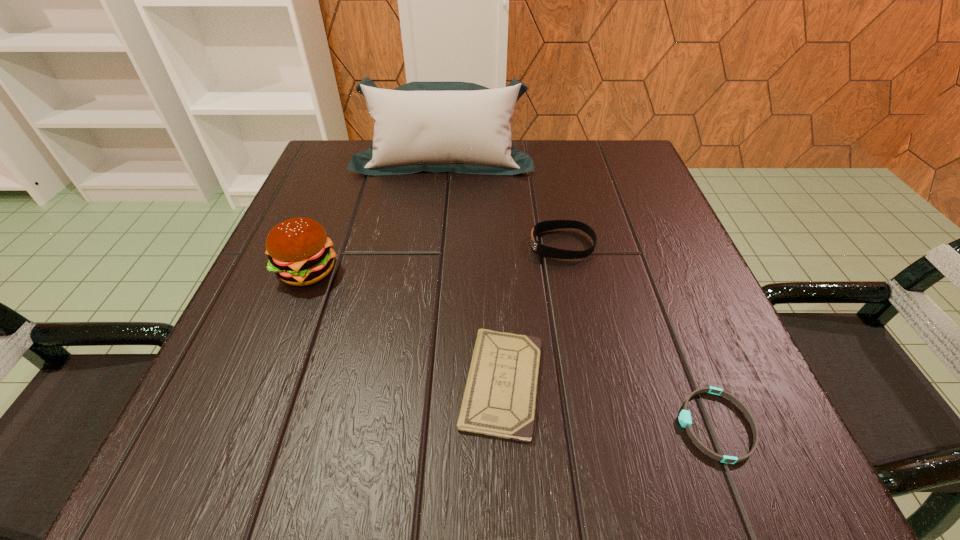
The height and width of the screenshot is (540, 960). Identify the location of vacant space that's between the second tallest object and the farthest object. (375, 214).

This screenshot has height=540, width=960. Identify the location of vacant space that's between the tallest object and the left wristband. (503, 201).

This screenshot has width=960, height=540. I want to click on empty location between the checkbook and the rightmost object, so click(609, 404).

At what (x,y) coordinates should I click in order to perform the action: click on vacant area that lies between the third tallest object and the nearer wristband. Please return your answer as a coordinate pair (x, y). The image size is (960, 540). Looking at the image, I should click on (638, 335).

The height and width of the screenshot is (540, 960). I want to click on free point between the checkbook and the taller wristband, so click(x=532, y=314).

The image size is (960, 540). I want to click on vacant space that's between the nearer wristband and the cushion, so click(x=579, y=292).

I want to click on vacant space that's between the checkbook and the cushion, so click(x=473, y=271).

You are a GUI agent. You are given a task and a screenshot of the screen. Output one action in this format:
    pyautogui.click(x=<x>, y=<y>)
    Task: Click on the vacant area that lies between the cushion and the nearer wristband
    The width and height of the screenshot is (960, 540).
    Given the screenshot: What is the action you would take?
    pyautogui.click(x=579, y=292)

The image size is (960, 540). In order to click on vacant region between the checkbook and the right wristband in this screenshot , I will do `click(609, 404)`.

You are a GUI agent. You are given a task and a screenshot of the screen. Output one action in this format:
    pyautogui.click(x=<x>, y=<y>)
    Task: Click on the vacant space in between the taller wristband and the checkbook
    
    Given the screenshot: What is the action you would take?
    pyautogui.click(x=532, y=314)